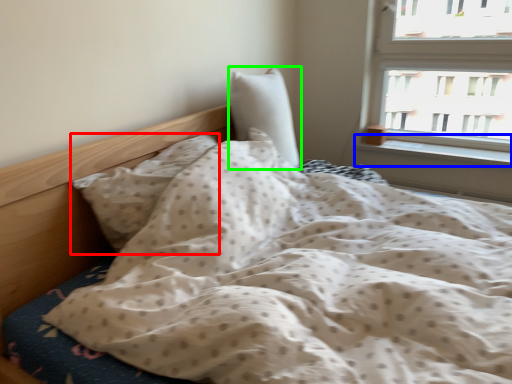
Question: Based on their relative distances, which object is nearer to pillow (highlighted by a red box)? Choose from window sill (highlighted by a blue box) and pillow (highlighted by a green box).

Choices:
 (A) window sill
 (B) pillow

Answer: (B)